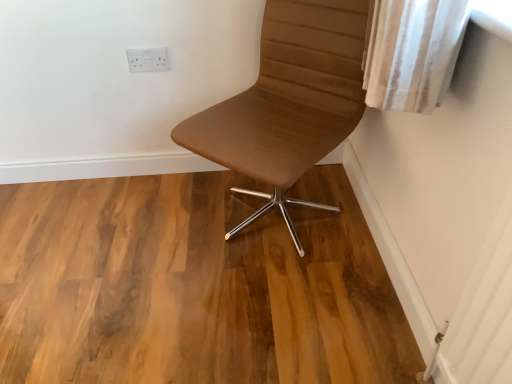
Question: Is brown leather chair at center turned away from natural wood floor at center?

Choices:
 (A) yes
 (B) no

Answer: (B)

Question: Considering the relative sizes of brown leather chair at center and natural wood floor at center in the image provided, is brown leather chair at center thinner than natural wood floor at center?

Choices:
 (A) yes
 (B) no

Answer: (A)

Question: Is brown leather chair at center wider than natural wood floor at center?

Choices:
 (A) no
 (B) yes

Answer: (A)

Question: From a real-world perspective, is brown leather chair at center positioned over natural wood floor at center based on gravity?

Choices:
 (A) no
 (B) yes

Answer: (B)

Question: From the image's perspective, would you say brown leather chair at center is shown under natural wood floor at center?

Choices:
 (A) yes
 (B) no

Answer: (B)

Question: Looking at their shapes, would you say brown leather chair at center is wider or thinner than white plastic outlet at upper center?

Choices:
 (A) thin
 (B) wide

Answer: (B)

Question: From the image's perspective, is brown leather chair at center located above or below white plastic outlet at upper center?

Choices:
 (A) above
 (B) below

Answer: (B)

Question: In the image, is brown leather chair at center positioned in front of or behind white plastic outlet at upper center?

Choices:
 (A) front
 (B) behind

Answer: (A)

Question: From a real-world perspective, relative to white plastic outlet at upper center, is brown leather chair at center vertically above or below?

Choices:
 (A) below
 (B) above

Answer: (A)

Question: Choose the correct answer: Is brown leather chair at center inside natural wood floor at center or outside it?

Choices:
 (A) inside
 (B) outside

Answer: (B)

Question: In terms of height, does brown leather chair at center look taller or shorter compared to natural wood floor at center?

Choices:
 (A) short
 (B) tall

Answer: (B)

Question: Looking at their shapes, would you say brown leather chair at center is wider or thinner than natural wood floor at center?

Choices:
 (A) thin
 (B) wide

Answer: (A)

Question: From the image's perspective, is brown leather chair at center above or below natural wood floor at center?

Choices:
 (A) above
 (B) below

Answer: (A)

Question: From a real-world perspective, relative to natural wood floor at center, is white plastic outlet at upper center vertically above or below?

Choices:
 (A) above
 (B) below

Answer: (A)

Question: Is white plastic outlet at upper center taller or shorter than natural wood floor at center?

Choices:
 (A) tall
 (B) short

Answer: (A)